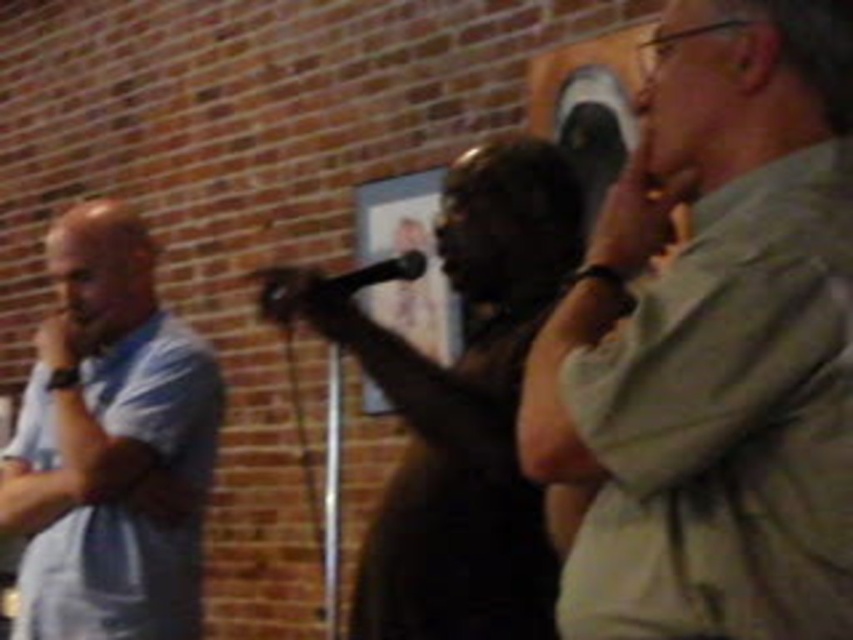
You are a photographer at the event and want to capture a photo where both the light khaki shirt at right and the matte black dress at center are visible. Which clothing item is shorter and needs to be positioned closer to the camera to ensure it stays in frame?

The light khaki shirt at right is shorter than the matte black dress at center, so it should be positioned closer to the camera to ensure it stays in frame.